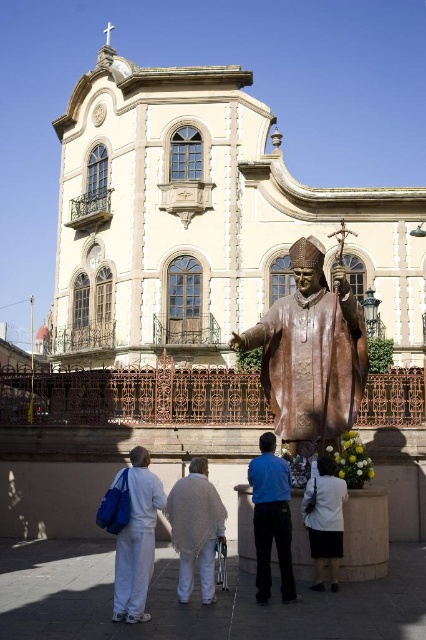
Can you confirm if white cotton pants at lower left is bigger than white fabric at lower center?

No.

Does white cotton pants at lower left appear on the left side of white fabric at lower center?

Correct, you'll find white cotton pants at lower left to the left of white fabric at lower center.

This screenshot has height=640, width=426. In order to click on white cotton pants at lower left in this screenshot , I will do pyautogui.click(x=137, y=538).

Where is `white cotton pants at lower left`? The image size is (426, 640). white cotton pants at lower left is located at coordinates (137, 538).

Who is positioned more to the left, bronze statue at center or white fabric at lower center?

white fabric at lower center

Is bronze statue at center shorter than white fabric at lower center?

No.

Is point (279, 404) behind point (327, 467)?

Yes, it is.

The height and width of the screenshot is (640, 426). Identify the location of bronze statue at center. (310, 353).

Find the location of `bronze statue at center`. bronze statue at center is located at coordinates pos(310,353).

Looking at this image, which is more to the right, bronze statue at center or white cotton pants at lower left?

From the viewer's perspective, bronze statue at center appears more on the right side.

Is point (273, 413) behind point (121, 476)?

Yes.

This screenshot has height=640, width=426. I want to click on bronze statue at center, so click(310, 353).